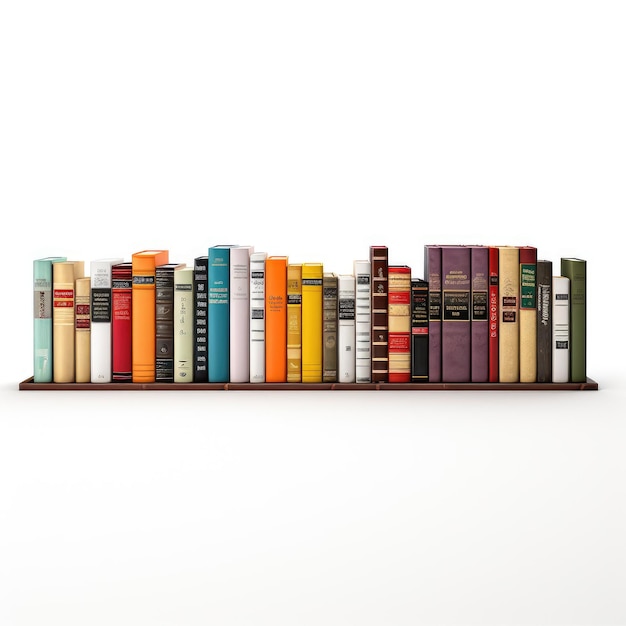
The image size is (626, 626). In order to click on white books in this screenshot , I will do [x=558, y=364], [x=362, y=347], [x=345, y=347], [x=255, y=344], [x=101, y=340].